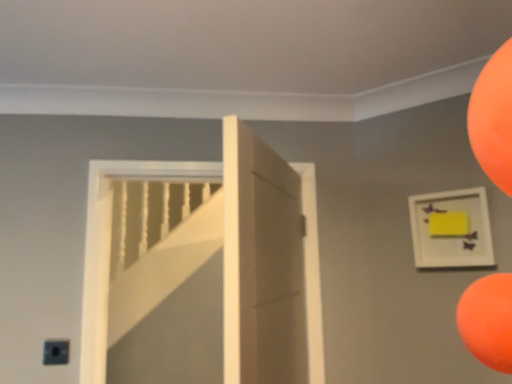
What do you see at coordinates (261, 263) in the screenshot? I see `white matte door at center` at bounding box center [261, 263].

In order to face white matte door at center, should I rotate leftwards or rightwards?

Turn right approximately 2.155 degrees to face it.

The width and height of the screenshot is (512, 384). What are the coordinates of `white matte door at center` in the screenshot? It's located at (261, 263).

Where is `yellow matte picture frame at upper right`? The width and height of the screenshot is (512, 384). yellow matte picture frame at upper right is located at coordinates (451, 229).

Image resolution: width=512 pixels, height=384 pixels. Describe the element at coordinates (451, 229) in the screenshot. I see `yellow matte picture frame at upper right` at that location.

Find the location of a particular element. The image size is (512, 384). white matte door at center is located at coordinates (261, 263).

Considering the positions of objects white matte door at center and yellow matte picture frame at upper right in the image provided, who is more to the right, white matte door at center or yellow matte picture frame at upper right?

From the viewer's perspective, yellow matte picture frame at upper right appears more on the right side.

In the scene shown: Is white matte door at center in front of or behind yellow matte picture frame at upper right in the image?

white matte door at center is positioned closer to the viewer than yellow matte picture frame at upper right.

Does point (290, 270) lie in front of point (473, 207)?

No, it is not.

From the image's perspective, is white matte door at center located above yellow matte picture frame at upper right?

No.

From a real-world perspective, does white matte door at center sit lower than yellow matte picture frame at upper right?

Indeed, from a real-world perspective, white matte door at center is positioned beneath yellow matte picture frame at upper right.

Can you confirm if white matte door at center is wider than yellow matte picture frame at upper right?

Yes, white matte door at center is wider than yellow matte picture frame at upper right.

Is white matte door at center taller or shorter than yellow matte picture frame at upper right?

Clearly, white matte door at center is taller compared to yellow matte picture frame at upper right.

Who is bigger, white matte door at center or yellow matte picture frame at upper right?

With larger size is white matte door at center.

Is white matte door at center positioned beyond the bounds of yellow matte picture frame at upper right?

Indeed, white matte door at center is completely outside yellow matte picture frame at upper right.

Is there a large distance between white matte door at center and yellow matte picture frame at upper right?

white matte door at center is near yellow matte picture frame at upper right, not far away.

Is white matte door at center facing towards yellow matte picture frame at upper right?

No, white matte door at center is not turned towards yellow matte picture frame at upper right.

Can you tell me how much white matte door at center and yellow matte picture frame at upper right differ in facing direction?

white matte door at center and yellow matte picture frame at upper right are facing 66.2 degrees away from each other.

How far apart are white matte door at center and yellow matte picture frame at upper right?

The distance of white matte door at center from yellow matte picture frame at upper right is 23.07 inches.

Where is `picture frame above the white matte door at center (from the image's perspective)`? Image resolution: width=512 pixels, height=384 pixels. picture frame above the white matte door at center (from the image's perspective) is located at coordinates (x=451, y=229).

Visually, is yellow matte picture frame at upper right positioned to the left or to the right of white matte door at center?

In the image, yellow matte picture frame at upper right appears on the right side of white matte door at center.

Which object is closer to the camera, yellow matte picture frame at upper right or white matte door at center?

white matte door at center is in front.

Which point is more forward, [464,250] or [264,143]?

The point [264,143] is more forward.

From the image's perspective, which object appears higher, yellow matte picture frame at upper right or white matte door at center?

yellow matte picture frame at upper right.

From a real-world perspective, is yellow matte picture frame at upper right physically above white matte door at center?

Yes, from a real-world perspective, yellow matte picture frame at upper right is above white matte door at center.

Looking at their sizes, would you say yellow matte picture frame at upper right is wider or thinner than white matte door at center?

In the image, yellow matte picture frame at upper right appears to be more narrow than white matte door at center.

In terms of height, does yellow matte picture frame at upper right look taller or shorter compared to white matte door at center?

Clearly, yellow matte picture frame at upper right is shorter compared to white matte door at center.

Is yellow matte picture frame at upper right bigger than white matte door at center?

No.

Would you say yellow matte picture frame at upper right is inside or outside white matte door at center?

yellow matte picture frame at upper right is located beyond the bounds of white matte door at center.

From the picture: Is yellow matte picture frame at upper right directly adjacent to white matte door at center?

yellow matte picture frame at upper right is not next to white matte door at center, and they're not touching.

Is yellow matte picture frame at upper right facing away from white matte door at center?

No, yellow matte picture frame at upper right's orientation is not away from white matte door at center.

Where is `picture frame on the right of white matte door at center`? This screenshot has width=512, height=384. picture frame on the right of white matte door at center is located at coordinates (451, 229).

Find the location of a particular element. The height and width of the screenshot is (384, 512). door that is below the yellow matte picture frame at upper right (from the image's perspective) is located at coordinates (261, 263).

At what (x,y) coordinates should I click in order to perform the action: click on door on the left of yellow matte picture frame at upper right. Please return your answer as a coordinate pair (x, y). The image size is (512, 384). Looking at the image, I should click on (261, 263).